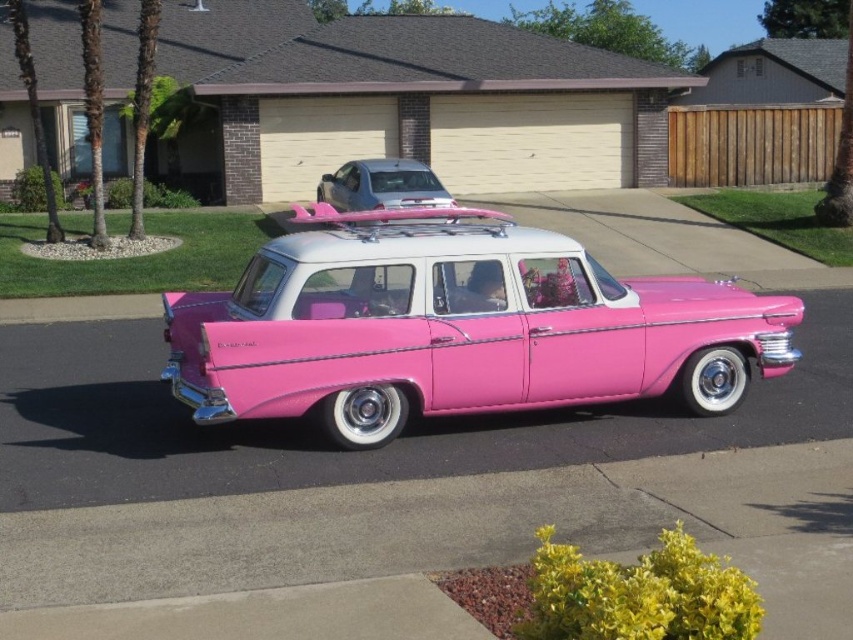
Question: Is pink glossy station wagon at center further to the viewer compared to metallic silver minivan at upper center?

Choices:
 (A) no
 (B) yes

Answer: (A)

Question: Estimate the real-world distances between objects in this image. Which object is farther from the pink glossy car at center?

Choices:
 (A) metallic silver minivan at upper center
 (B) pink glossy station wagon at center

Answer: (A)

Question: Which point is farther from the camera taking this photo?

Choices:
 (A) (244, 358)
 (B) (445, 195)
 (C) (695, 515)

Answer: (B)

Question: Is pink glossy car at center positioned in front of metallic silver minivan at upper center?

Choices:
 (A) no
 (B) yes

Answer: (B)

Question: Which point is farther to the camera?

Choices:
 (A) [x=463, y=467]
 (B) [x=587, y=320]

Answer: (B)

Question: Does pink glossy car at center lie in front of pink glossy station wagon at center?

Choices:
 (A) no
 (B) yes

Answer: (B)